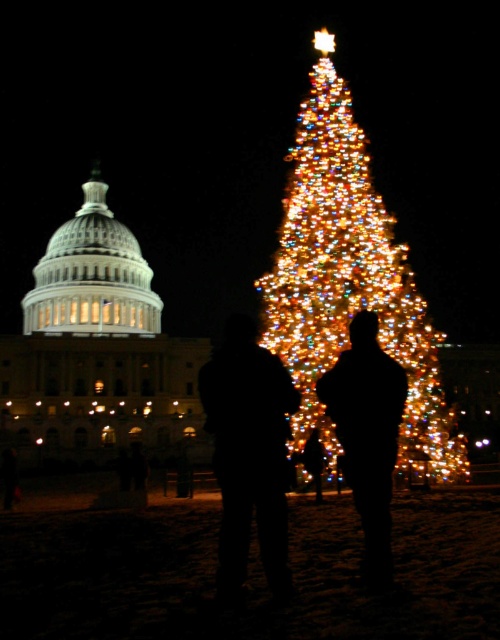
You are attending a Christmas event and see the illuminated glass christmas tree at center and the black silhouette couple at center. From your perspective, which object is positioned to the right?

The illuminated glass christmas tree at center is to the right of the black silhouette couple at center.

You are a photographer trying to capture a photo of both the black silhouette couple at center and the black matte figure at center in the same frame. Based on their positions, which one would appear larger in the photo?

The black silhouette couple at center would appear larger in the photo because they are closer to the viewer than the black matte figure at center.

You are attending a Christmas event and want to take a photo with the illuminated glass christmas tree at center and the black silhouette couple at center in the background. Can you position yourself so that both objects are visible in your camera frame?

The illuminated glass christmas tree at center is bigger than the black silhouette couple at center, so if you position yourself at a distance where the tree fits within the frame, the couple will also be visible as they are smaller in comparison.